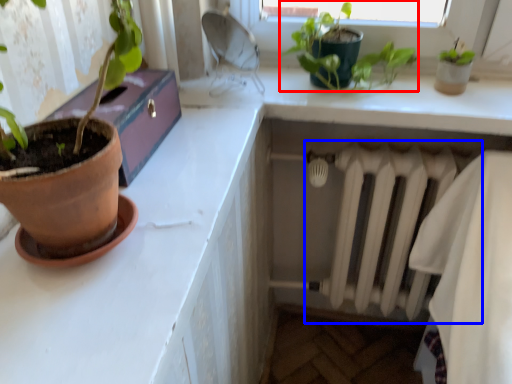
Question: Which point is closer to the camera, houseplant (highlighted by a red box) or radiator (highlighted by a blue box)?

Choices:
 (A) houseplant
 (B) radiator

Answer: (A)